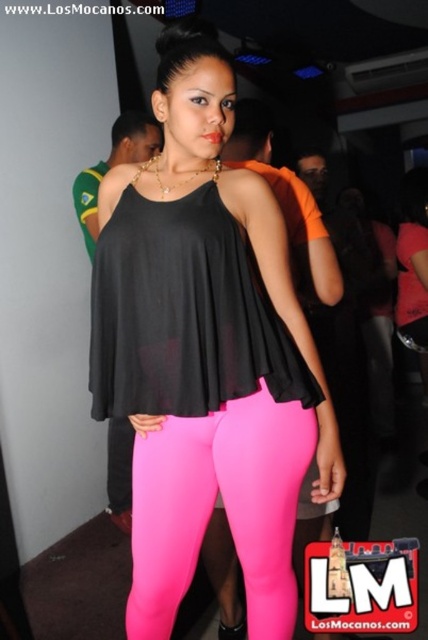
Question: Can you confirm if matte black top at center is bigger than neon pink leggings at center?

Choices:
 (A) no
 (B) yes

Answer: (B)

Question: Where is matte black top at center located in relation to neon pink leggings at center in the image?

Choices:
 (A) right
 (B) left

Answer: (B)

Question: Which of the following is the farthest from the observer?

Choices:
 (A) matte black top at center
 (B) neon pink leggings at center

Answer: (B)

Question: Which point is farther to the camera?

Choices:
 (A) (177, 484)
 (B) (214, 483)

Answer: (B)

Question: Which object appears closest to the camera in this image?

Choices:
 (A) neon pink leggings at center
 (B) matte black top at center

Answer: (B)

Question: Is matte black top at center positioned at the back of neon pink leggings at center?

Choices:
 (A) no
 (B) yes

Answer: (A)